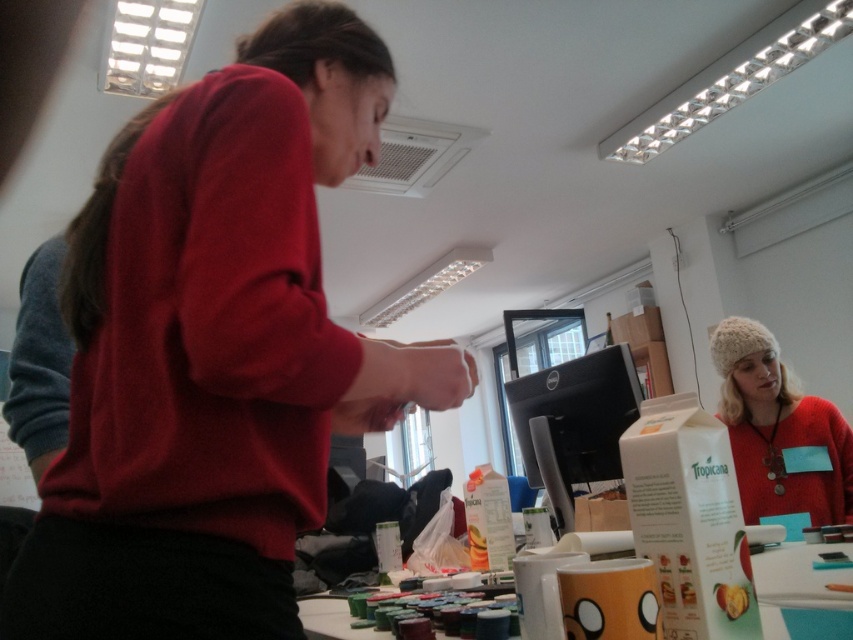
Question: Is knitted woolen hat at right in front of smooth peach at center?

Choices:
 (A) no
 (B) yes

Answer: (A)

Question: Which object is the closest to the matte orange mug at center?

Choices:
 (A) knitted woolen hat at right
 (B) matte red sweater at center
 (C) smooth peach at center

Answer: (C)

Question: Considering the relative positions of matte red sweater at center and black glossy monitor at center in the image provided, where is matte red sweater at center located with respect to black glossy monitor at center?

Choices:
 (A) above
 (B) below

Answer: (A)

Question: Among these points, which one is farthest from the camera?

Choices:
 (A) (831, 516)
 (B) (734, 609)
 (C) (612, 468)

Answer: (A)

Question: Can you confirm if knitted woolen hat at right is bigger than black glossy monitor at center?

Choices:
 (A) no
 (B) yes

Answer: (B)

Question: Which point is closer to the camera?

Choices:
 (A) knitted woolen hat at right
 (B) black glossy monitor at center
 (C) matte orange mug at center

Answer: (C)